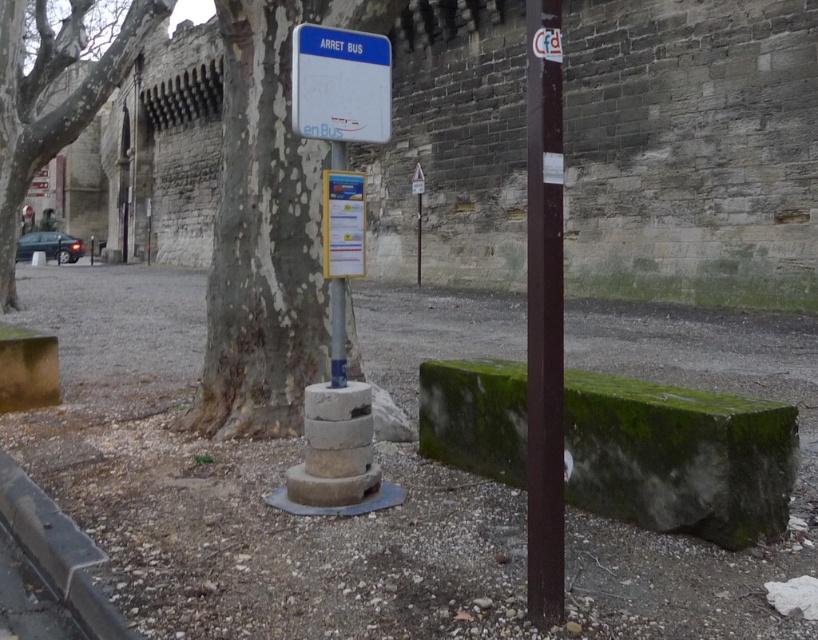
Does brown polished wood pole at right have a lesser height compared to smooth gray bark at left?

Correct, brown polished wood pole at right is not as tall as smooth gray bark at left.

Is point (551, 512) positioned behind point (102, 65)?

No, (551, 512) is in front of (102, 65).

The image size is (818, 640). I want to click on brown polished wood pole at right, so click(x=544, y=314).

Is brown polished wood pole at right closer to camera compared to white plastic bus stop sign at center?

Yes, it is in front of white plastic bus stop sign at center.

Is brown polished wood pole at right to the left of white plastic bus stop sign at center from the viewer's perspective?

Incorrect, brown polished wood pole at right is not on the left side of white plastic bus stop sign at center.

Is point (560, 280) positioned behind point (306, 33)?

That is True.

Locate an element on the screen. brown polished wood pole at right is located at coordinates (544, 314).

Who is higher up, white plastic bus stop sign at center or metallic signpost at center?

white plastic bus stop sign at center is above.

Does white plastic bus stop sign at center appear on the left side of metallic signpost at center?

In fact, white plastic bus stop sign at center is to the right of metallic signpost at center.

Does point (353, 65) come closer to viewer compared to point (336, 380)?

Yes, point (353, 65) is in front of point (336, 380).

This screenshot has height=640, width=818. Identify the location of white plastic bus stop sign at center. pyautogui.click(x=340, y=84).